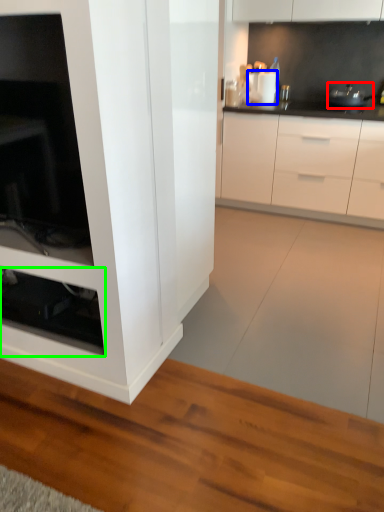
Question: Which is nearer to the appliance (highlighted by a red box)? appliance (highlighted by a blue box) or shelf (highlighted by a green box).

Choices:
 (A) appliance
 (B) shelf

Answer: (A)